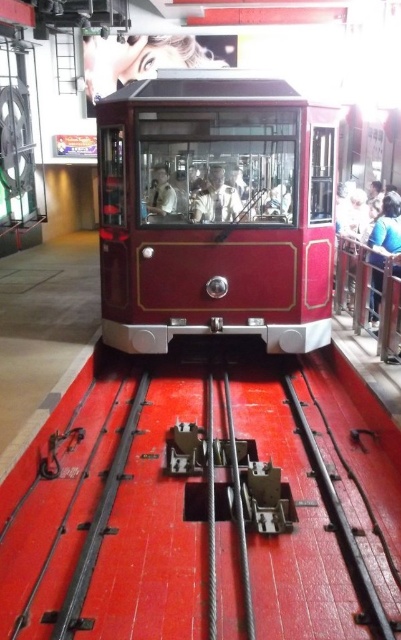
Between metallic red train track at center and shiny red tram at center, which one is positioned lower?

Positioned lower is metallic red train track at center.

Does metallic red train track at center have a greater width compared to shiny red tram at center?

Indeed, metallic red train track at center has a greater width compared to shiny red tram at center.

The height and width of the screenshot is (640, 401). Find the location of `metallic red train track at center`. metallic red train track at center is located at coordinates (111, 513).